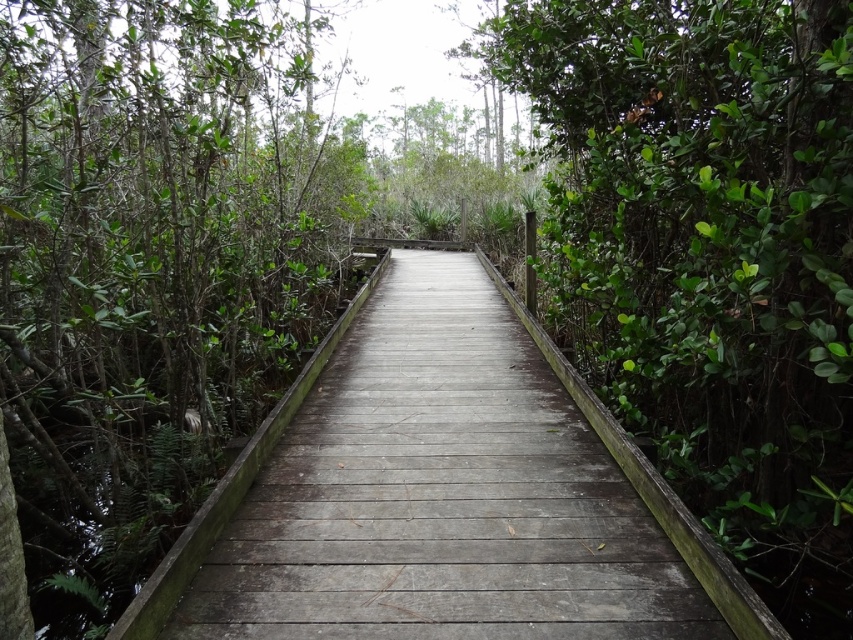
Question: Can you confirm if green leafy tree at left is bigger than green leafy bush at right?

Choices:
 (A) yes
 (B) no

Answer: (B)

Question: Estimate the real-world distances between objects in this image. Which object is closer to the green leafy bush at right?

Choices:
 (A) green leafy tree at left
 (B) weathered wood bridge at center

Answer: (B)

Question: Does green leafy bush at right appear under weathered wood bridge at center?

Choices:
 (A) no
 (B) yes

Answer: (A)

Question: Which of these objects is positioned closest to the weathered wood bridge at center?

Choices:
 (A) green leafy tree at left
 (B) green leafy bush at right

Answer: (B)

Question: Is green leafy tree at left further to camera compared to green leafy bush at right?

Choices:
 (A) yes
 (B) no

Answer: (A)

Question: Which of the following is the closest to the observer?

Choices:
 (A) (671, 284)
 (B) (363, 582)
 (C) (24, 161)

Answer: (B)